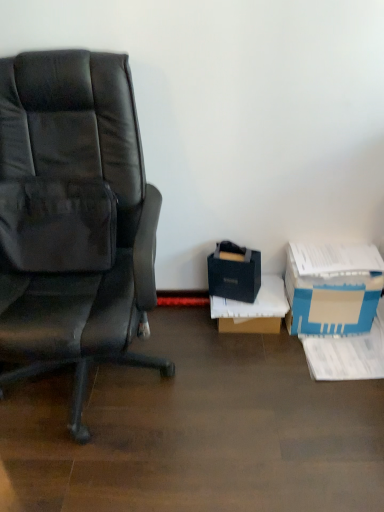
Question: Considering the relative sizes of black matte bag at lower right, the 3th box in the right-to-left sequence, and black matte box at lower right, acting as the 2th box starting from the right, in the image provided, is black matte bag at lower right, the 3th box in the right-to-left sequence, bigger than black matte box at lower right, acting as the 2th box starting from the right,?

Choices:
 (A) yes
 (B) no

Answer: (B)

Question: Considering the relative sizes of black matte bag at lower right, the 3th box in the right-to-left sequence, and black matte box at lower right, which is the 2th box from left to right, in the image provided, is black matte bag at lower right, the 3th box in the right-to-left sequence, shorter than black matte box at lower right, which is the 2th box from left to right,?

Choices:
 (A) no
 (B) yes

Answer: (A)

Question: Can you confirm if black matte bag at lower right, the 3th box in the right-to-left sequence, is positioned to the left of black matte box at lower right, which is the 2th box from left to right?

Choices:
 (A) yes
 (B) no

Answer: (A)

Question: Does black matte bag at lower right, placed as the 1th box when sorted from left to right, have a greater width compared to black matte box at lower right, acting as the 2th box starting from the right?

Choices:
 (A) yes
 (B) no

Answer: (B)

Question: Does black matte bag at lower right, the 3th box in the right-to-left sequence, have a lesser width compared to black matte box at lower right, which is the 2th box from left to right?

Choices:
 (A) yes
 (B) no

Answer: (A)

Question: Is point (145, 200) closer or farther from the camera than point (339, 293)?

Choices:
 (A) closer
 (B) farther

Answer: (A)

Question: In terms of height, does matte black chair at left look taller or shorter compared to blue cardboard box at lower right, which is the 3th box in left-to-right order?

Choices:
 (A) short
 (B) tall

Answer: (B)

Question: Is matte black chair at left inside the boundaries of blue cardboard box at lower right, which is the 3th box in left-to-right order, or outside?

Choices:
 (A) inside
 (B) outside

Answer: (B)

Question: Considering the relative positions of matte black chair at left and blue cardboard box at lower right, which is the 3th box in left-to-right order, in the image provided, is matte black chair at left to the left or to the right of blue cardboard box at lower right, which is the 3th box in left-to-right order,?

Choices:
 (A) right
 (B) left

Answer: (B)

Question: Is black matte box at lower right, which is the 2th box from left to right, spatially inside blue cardboard box at lower right, the first box in the right-to-left sequence, or outside of it?

Choices:
 (A) inside
 (B) outside

Answer: (B)

Question: From the image's perspective, is black matte box at lower right, acting as the 2th box starting from the right, positioned above or below blue cardboard box at lower right, the first box in the right-to-left sequence?

Choices:
 (A) above
 (B) below

Answer: (B)

Question: Is black matte box at lower right, acting as the 2th box starting from the right, taller or shorter than blue cardboard box at lower right, which is the 3th box in left-to-right order?

Choices:
 (A) short
 (B) tall

Answer: (A)

Question: In terms of width, does black matte box at lower right, acting as the 2th box starting from the right, look wider or thinner when compared to blue cardboard box at lower right, the first box in the right-to-left sequence?

Choices:
 (A) wide
 (B) thin

Answer: (A)

Question: From the image's perspective, is black matte bag at lower right, placed as the 1th box when sorted from left to right, located above or below black matte box at lower right, acting as the 2th box starting from the right?

Choices:
 (A) above
 (B) below

Answer: (A)

Question: Is point (256, 290) closer or farther from the camera than point (225, 307)?

Choices:
 (A) farther
 (B) closer

Answer: (A)